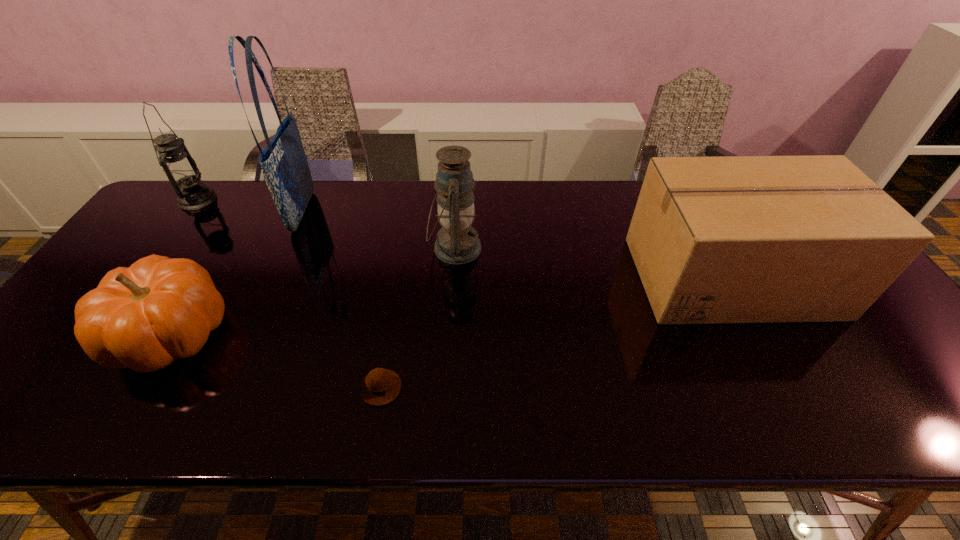
Where is `vacant area that lies between the farther oil lamp and the shopping bag`? vacant area that lies between the farther oil lamp and the shopping bag is located at coordinates (251, 206).

The height and width of the screenshot is (540, 960). Find the location of `vacant space that is in between the fourth object from right to left and the pumpkin`. vacant space that is in between the fourth object from right to left and the pumpkin is located at coordinates (237, 273).

Locate an element on the screen. vacant area between the fifth object from left to right and the pumpkin is located at coordinates (313, 291).

The height and width of the screenshot is (540, 960). In order to click on the third closest object to the third object from left to right in this screenshot , I will do `click(457, 242)`.

Select which object appears as the third closest to the muffin. Please provide its 2D coordinates. Your answer should be formatted as a tuple, i.e. [(x, y)], where the tuple contains the x and y coordinates of a point satisfying the conditions above.

[(285, 168)]

Find the location of a particular element. The image size is (960, 540). free space that satisfies the following two spatial constraints: 1. on the front-facing side of the tallest object; 2. on the right side of the third object from right to left is located at coordinates (223, 388).

The height and width of the screenshot is (540, 960). What are the coordinates of `vacant space that satisfies the following two spatial constraints: 1. on the front-facing side of the third object from left to right; 2. on the right side of the fourth object from left to right` in the screenshot? It's located at (223, 388).

This screenshot has width=960, height=540. What are the coordinates of `free spot that satisfies the following two spatial constraints: 1. on the back side of the fourth object from left to right; 2. on the front-facing side of the tallest object` in the screenshot? It's located at (412, 212).

Identify the location of vacant region that satisfies the following two spatial constraints: 1. on the front-facing side of the fourth object from right to left; 2. on the right side of the second object from right to left. (286, 248).